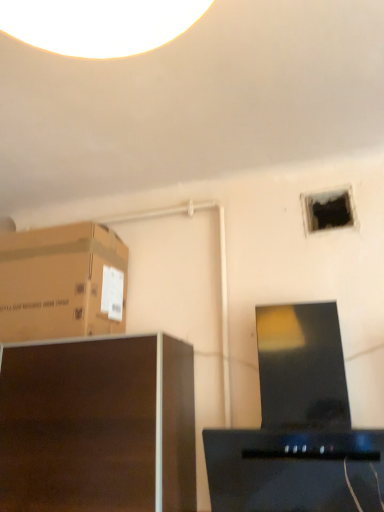
Question: Is brown cardboard box at upper left shorter than black glossy desktop computer at center?

Choices:
 (A) no
 (B) yes

Answer: (B)

Question: From a real-world perspective, is brown cardboard box at upper left beneath black glossy desktop computer at center?

Choices:
 (A) no
 (B) yes

Answer: (A)

Question: Is brown cardboard box at upper left located outside black glossy desktop computer at center?

Choices:
 (A) yes
 (B) no

Answer: (A)

Question: Does brown cardboard box at upper left have a larger size compared to black glossy desktop computer at center?

Choices:
 (A) yes
 (B) no

Answer: (B)

Question: Is brown cardboard box at upper left turned away from black glossy desktop computer at center?

Choices:
 (A) yes
 (B) no

Answer: (B)

Question: Is brown cardboard box at upper left wider than black glossy desktop computer at center?

Choices:
 (A) yes
 (B) no

Answer: (A)

Question: Is black glossy desktop computer at center in front of brown cardboard box at upper left?

Choices:
 (A) no
 (B) yes

Answer: (B)

Question: From the image's perspective, does black glossy desktop computer at center appear lower than brown cardboard box at upper left?

Choices:
 (A) yes
 (B) no

Answer: (A)

Question: Is black glossy desktop computer at center wider than brown cardboard box at upper left?

Choices:
 (A) yes
 (B) no

Answer: (B)

Question: Is black glossy desktop computer at center at the right side of brown cardboard box at upper left?

Choices:
 (A) yes
 (B) no

Answer: (A)

Question: From the image's perspective, is black glossy desktop computer at center over brown cardboard box at upper left?

Choices:
 (A) no
 (B) yes

Answer: (A)

Question: Is black glossy desktop computer at center taller than brown cardboard box at upper left?

Choices:
 (A) no
 (B) yes

Answer: (B)

Question: Is dark wood cabinet at lower left outside black glossy desktop computer at center?

Choices:
 (A) no
 (B) yes

Answer: (B)